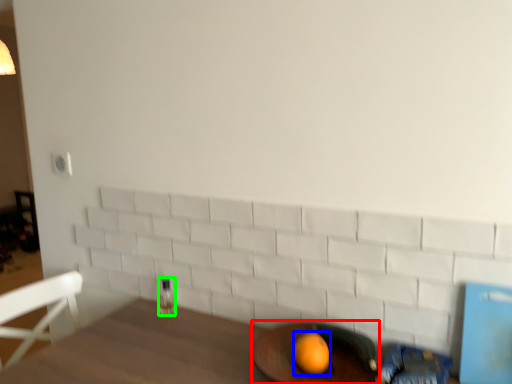
Question: Which is nearer to the round table (highlighted by a red box)? orange (highlighted by a blue box) or beverage (highlighted by a green box).

Choices:
 (A) orange
 (B) beverage

Answer: (A)